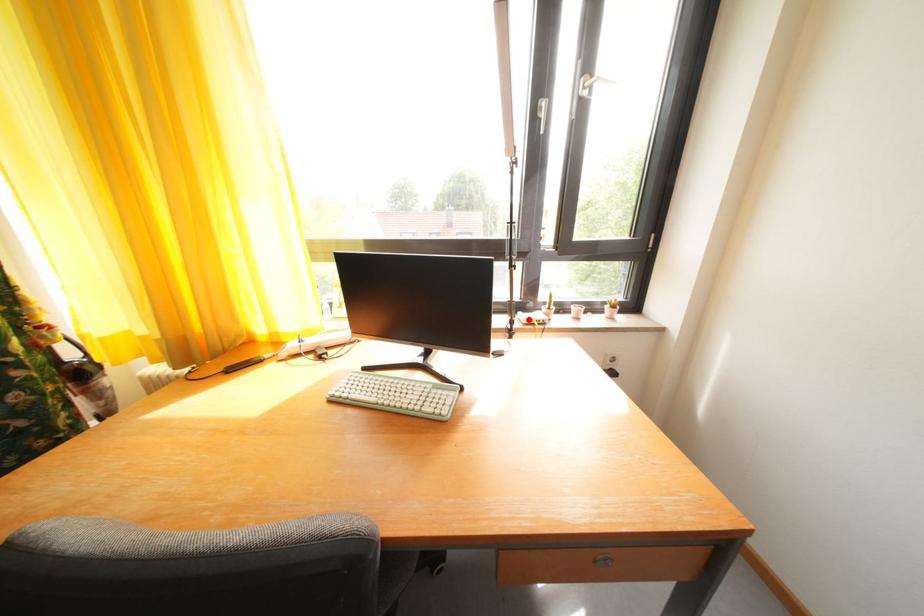
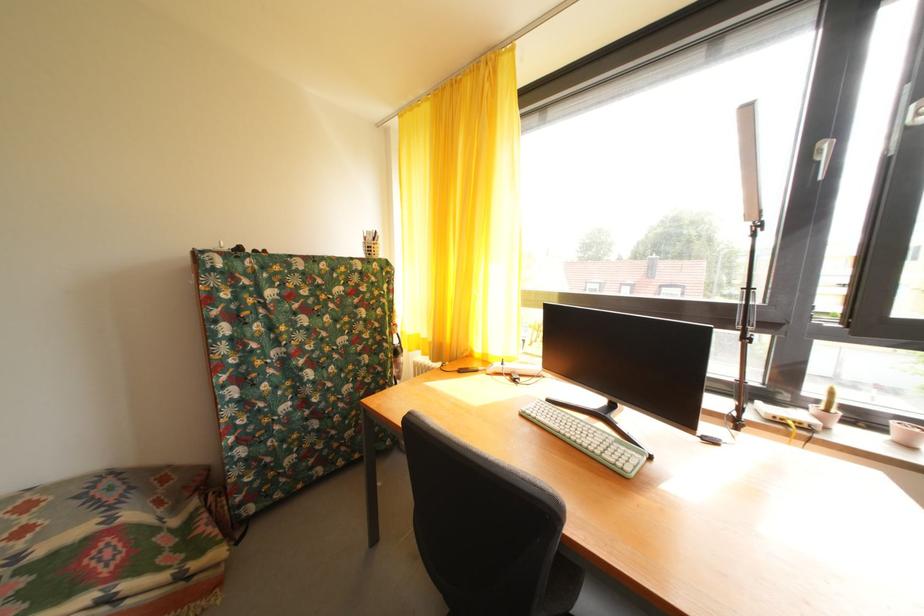
In the second image, find the point that corresponds to the highlighted location in the first image.

(768, 408)